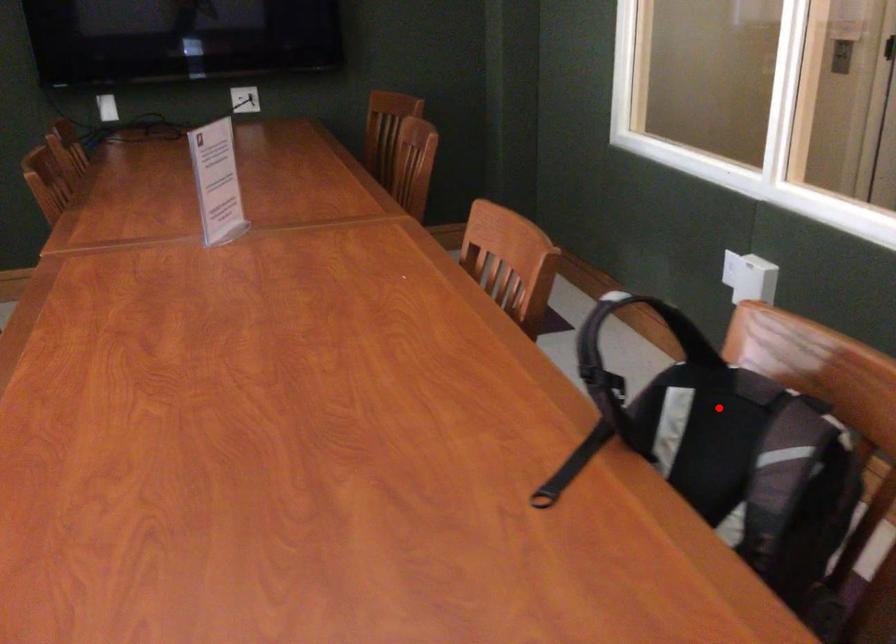
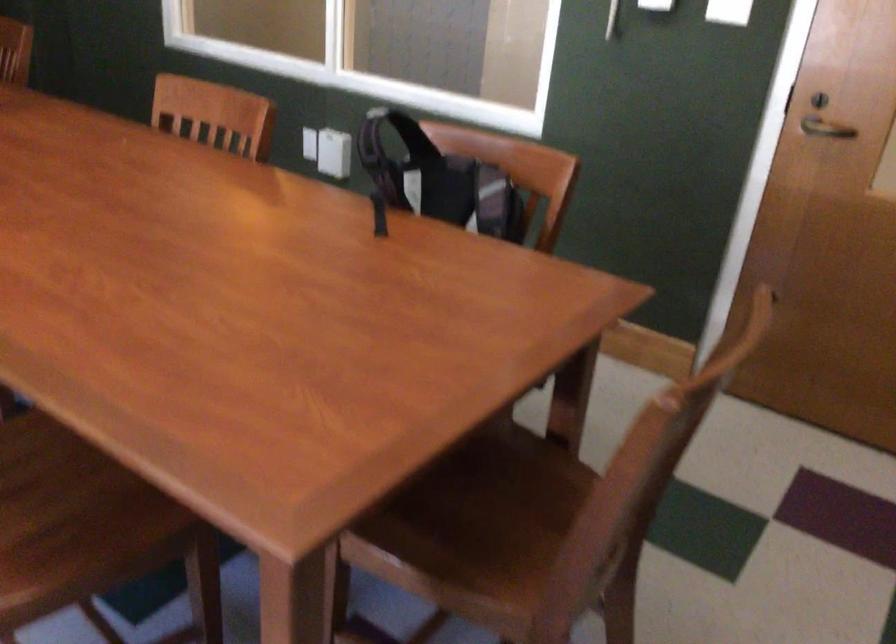
Question: A red point is marked in image1. In image2, is the corresponding 3D point closer to the camera or farther? Reply with the corresponding letter.

Choices:
 (A) The corresponding 3D point is closer.
 (B) The corresponding 3D point is farther.

Answer: (B)